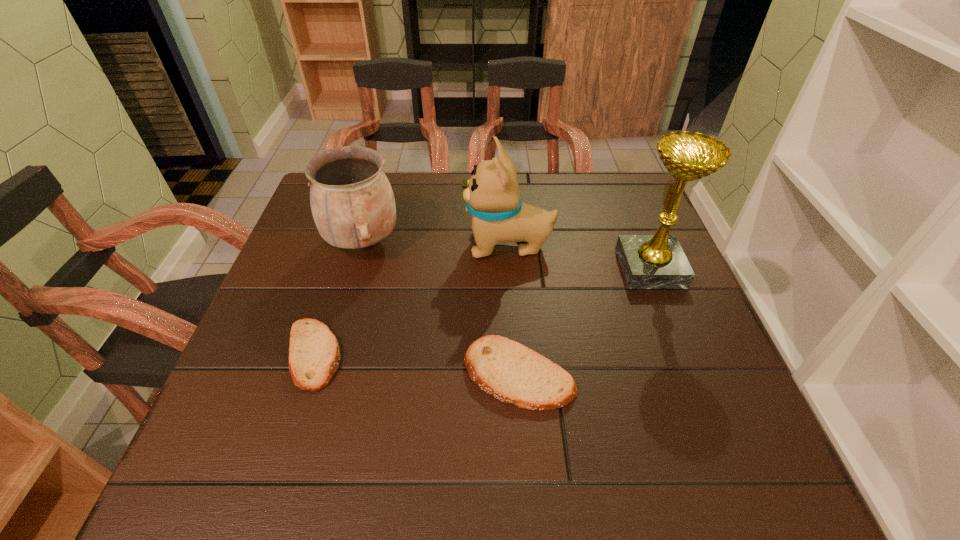
Where is `blank region between the third shortest object and the award`? blank region between the third shortest object and the award is located at coordinates (507, 255).

Find the location of a particular element. free space between the shorter pita bread and the fourth shortest object is located at coordinates pyautogui.click(x=411, y=300).

Where is `free space between the third tallest object and the rightmost object`? The height and width of the screenshot is (540, 960). free space between the third tallest object and the rightmost object is located at coordinates (507, 255).

The image size is (960, 540). I want to click on free space between the shortest object and the third shortest object, so click(338, 299).

Locate an element on the screen. vacant point located between the fourth shortest object and the shorter pita bread is located at coordinates (411, 300).

The height and width of the screenshot is (540, 960). Find the location of `free spot between the left pita bread and the second tallest object`. free spot between the left pita bread and the second tallest object is located at coordinates (411, 300).

At what (x,y) coordinates should I click in order to perform the action: click on empty space between the puppy and the award. Please return your answer as a coordinate pair (x, y). This screenshot has width=960, height=540. Looking at the image, I should click on (579, 256).

You are a GUI agent. You are given a task and a screenshot of the screen. Output one action in this format:
    pyautogui.click(x=<x>, y=<y>)
    Task: Click on the free space between the second tallest object and the urn
    The height and width of the screenshot is (540, 960).
    Given the screenshot: What is the action you would take?
    pyautogui.click(x=436, y=244)

Find the location of a particular element. Image resolution: width=960 pixels, height=540 pixels. object that stands as the second closest to the shorter pita bread is located at coordinates (507, 370).

The height and width of the screenshot is (540, 960). I want to click on object that ranks as the third closest to the puppy, so click(x=507, y=370).